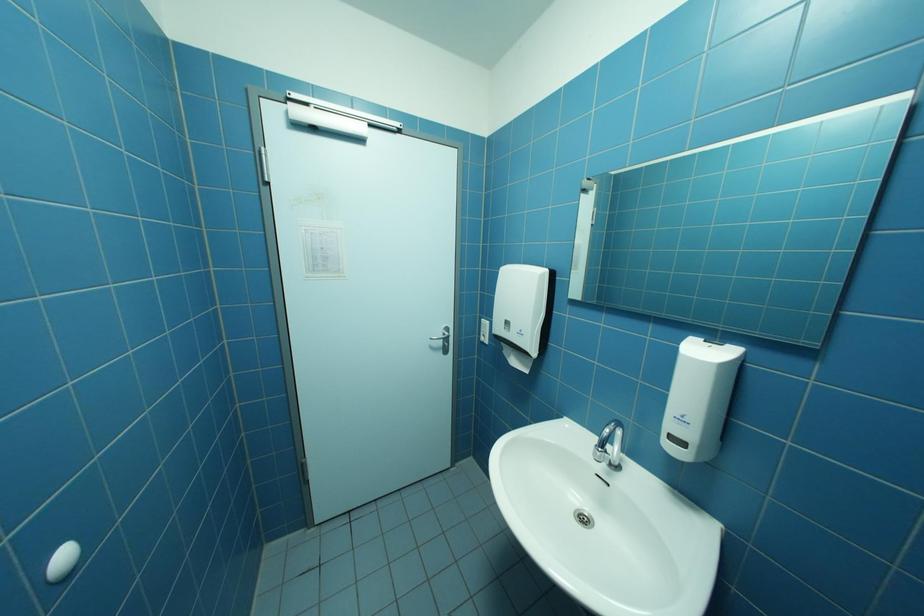
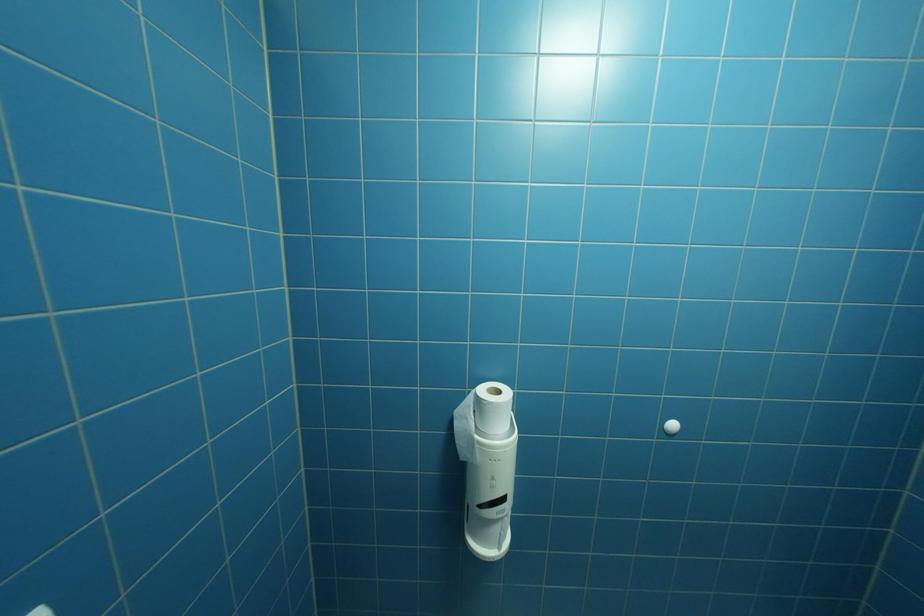
Question: How did the camera likely rotate?

Choices:
 (A) Left
 (B) Right
 (C) Up
 (D) Down

Answer: (A)